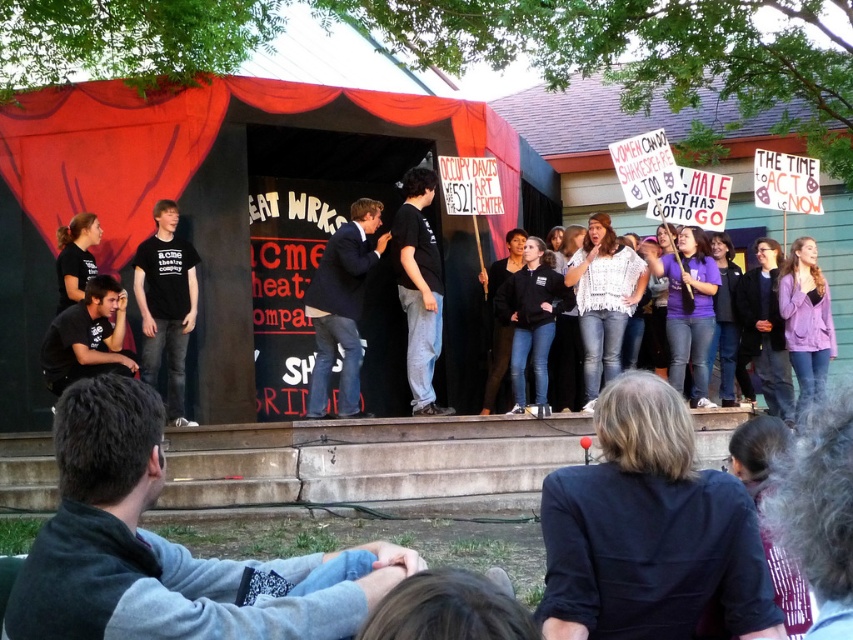
You are directing a play and want to position two actors at the points labeled point (146, 324) and point (419, 332). Which actor should be placed closer to the audience to ensure they are more visible?

The actor placed at point (146, 324) should be closer to the audience because it is in front of point (419, 332) according to the spatial relationship provided.